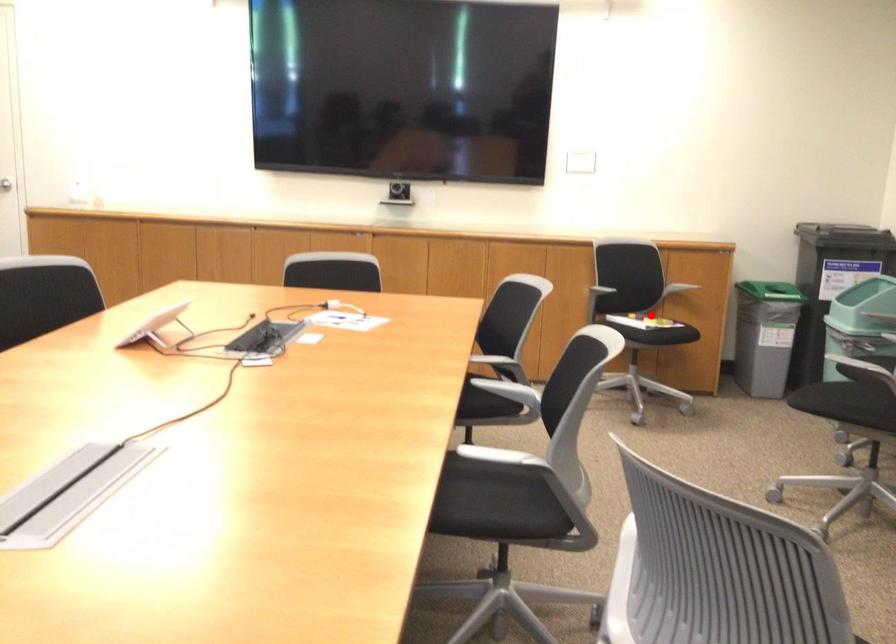
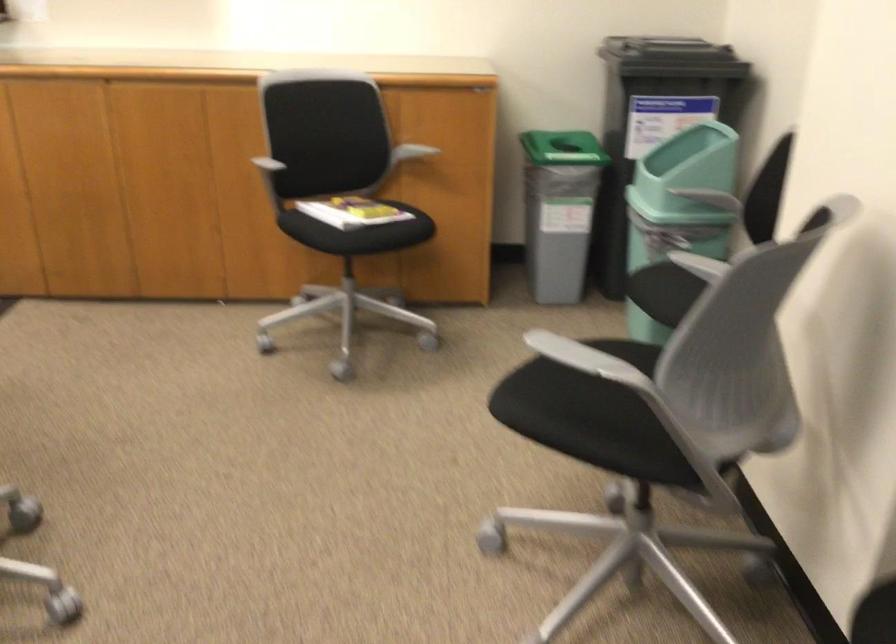
Question: I am providing you with two images of the same scene from different viewpoints. A red point is shown in image1. For the corresponding object point in image2, is it positioned nearer or farther from the camera?

Choices:
 (A) Nearer
 (B) Farther

Answer: (A)